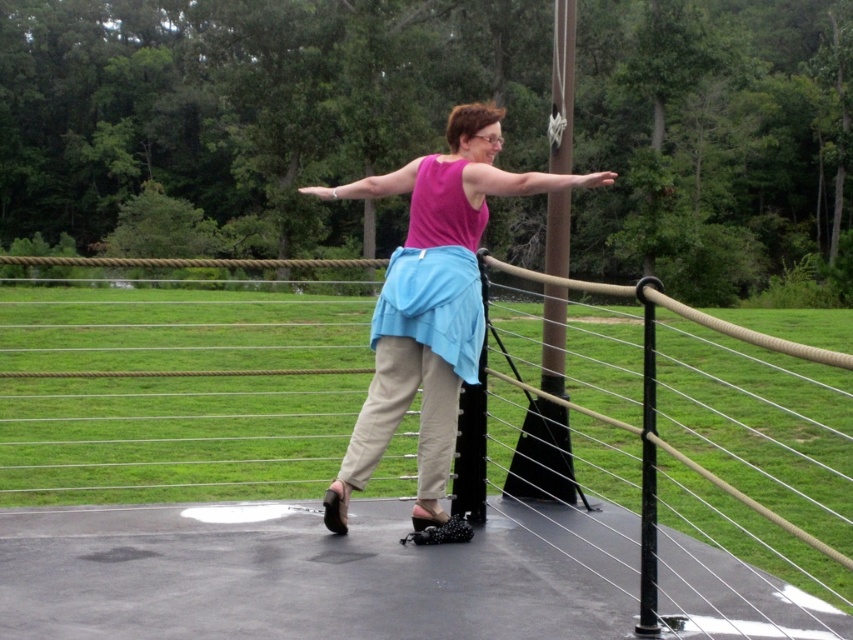
Question: Which point is farther from the camera taking this photo?

Choices:
 (A) (798, 502)
 (B) (341, 477)

Answer: (A)

Question: Which point is closer to the camera?

Choices:
 (A) ropematerialfence at center
 (B) pink fabric skirt at center

Answer: (A)

Question: Can you confirm if ropematerialfence at center is positioned below pink fabric skirt at center?

Choices:
 (A) no
 (B) yes

Answer: (B)

Question: Considering the relative positions of ropematerialfence at center and pink fabric skirt at center in the image provided, where is ropematerialfence at center located with respect to pink fabric skirt at center?

Choices:
 (A) above
 (B) below

Answer: (B)

Question: Is ropematerialfence at center to the left of pink fabric skirt at center from the viewer's perspective?

Choices:
 (A) no
 (B) yes

Answer: (B)